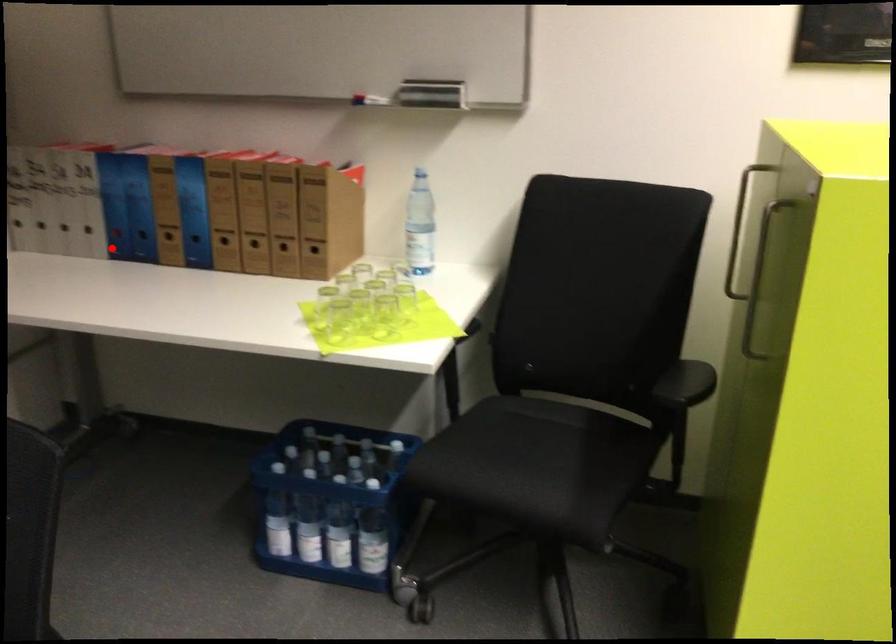
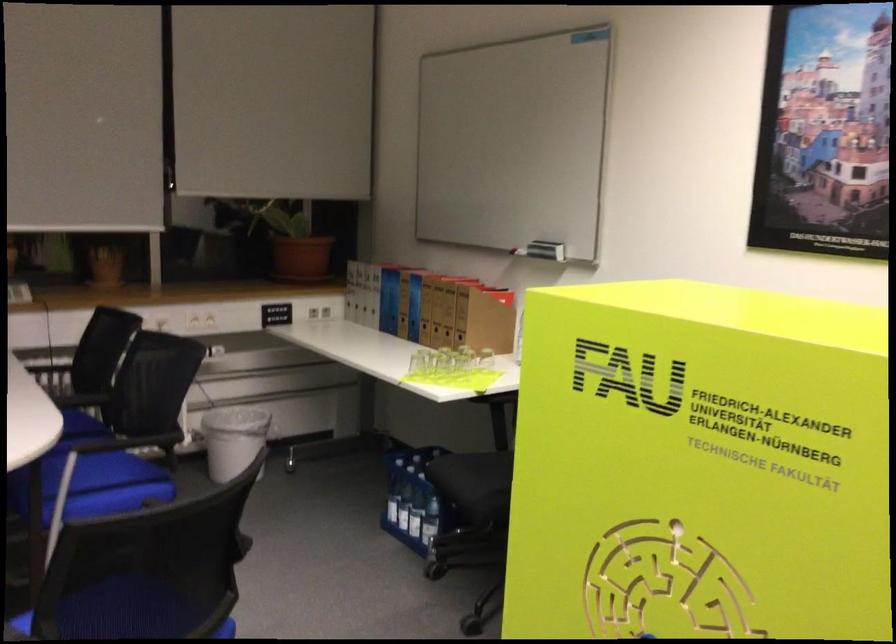
In the second image, find the point that corresponds to the highlighted location in the first image.

(382, 321)